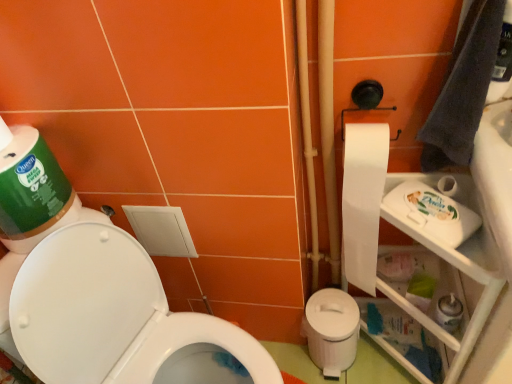
At what (x,y) coordinates should I click in order to perform the action: click on white glossy toilet at lower left. Please return your answer as a coordinate pair (x, y). This screenshot has width=512, height=384. Looking at the image, I should click on (117, 318).

Where is `white plastic potty at lower right`? This screenshot has width=512, height=384. white plastic potty at lower right is located at coordinates (331, 330).

This screenshot has width=512, height=384. I want to click on white paper at right, so click(362, 200).

What do you see at coordinates (463, 89) in the screenshot? I see `gray fabric hand towel at upper right` at bounding box center [463, 89].

This screenshot has width=512, height=384. I want to click on white glossy toilet at lower left, so click(117, 318).

Is point (208, 379) more distant than point (502, 127)?

That is True.

Can you tell me how much white glossy toilet at lower left and white glossy sink at upper right differ in facing direction?

white glossy toilet at lower left and white glossy sink at upper right are facing 88.3 degrees away from each other.

Is white glossy toilet at lower left directly adjacent to white glossy sink at upper right?

No, white glossy toilet at lower left is not next to white glossy sink at upper right.

Considering the sizes of objects white glossy toilet at lower left and white glossy sink at upper right in the image provided, who is shorter, white glossy toilet at lower left or white glossy sink at upper right?

Standing shorter between the two is white glossy sink at upper right.

Identify the location of shelf on the right of the white paper at right. The height and width of the screenshot is (384, 512). (462, 271).

Relative to white paper at right, is white plastic shelf at right in front or behind?

Clearly, white plastic shelf at right is in front of white paper at right.

From the image's perspective, between white plastic shelf at right and white paper at right, which one is located above?

white paper at right appears higher in the image.

You are a GUI agent. You are given a task and a screenshot of the screen. Output one action in this format:
    pyautogui.click(x=<x>, y=<y>)
    Task: Click on the toilet paper positioned vertically above the white plastic potty at lower right (from a real-world perspective)
    Image resolution: width=512 pixels, height=384 pixels.
    Given the screenshot: What is the action you would take?
    pyautogui.click(x=362, y=200)

From the image's perspective, is white plastic potty at lower right above white paper at right?

No, from the image's perspective, white plastic potty at lower right is not over white paper at right.

From a real-world perspective, is white plastic potty at lower right positioned above or below white paper at right?

In terms of real-world spatial position, white plastic potty at lower right is below white paper at right.

Is white plastic potty at lower right bigger than white paper at right?

Correct, white plastic potty at lower right is larger in size than white paper at right.

Are white paper at right and gray fabric hand towel at upper right far apart?

They are positioned close to each other.

Between point (346, 161) and point (483, 99), which one is positioned behind?

The point (346, 161) is more distant.

From the image's perspective, is white paper at right above or below gray fabric hand towel at upper right?

Clearly, from the image's perspective, white paper at right is below gray fabric hand towel at upper right.

Can you tell me how much white paper at right and gray fabric hand towel at upper right differ in facing direction?

white paper at right and gray fabric hand towel at upper right are facing 5.97e-05 degrees away from each other.

From a real-world perspective, between white plastic shelf at right and white plastic potty at lower right, who is vertically higher?

white plastic shelf at right is physically above.

This screenshot has width=512, height=384. Find the location of `shelf above the white plastic potty at lower right (from the image's perspective)`. shelf above the white plastic potty at lower right (from the image's perspective) is located at coordinates (462, 271).

Is white plastic potty at lower right inside white plastic shelf at right?

Yes, white plastic shelf at right contains white plastic potty at lower right.

Measure the distance from white plastic shelf at right to white plastic potty at lower right.

white plastic shelf at right is 10.98 inches away from white plastic potty at lower right.

Based on their positions, is white plastic shelf at right located to the left or right of white glossy toilet at lower left?

white plastic shelf at right is positioned on white glossy toilet at lower left's right side.

Would you consider white plastic shelf at right to be distant from white glossy toilet at lower left?

No, there isn't a large distance between white plastic shelf at right and white glossy toilet at lower left.

Can you confirm if white plastic shelf at right is taller than white glossy toilet at lower left?

Incorrect, the height of white plastic shelf at right is not larger of that of white glossy toilet at lower left.

Between white plastic shelf at right and white glossy toilet at lower left, which one has smaller width?

Thinner between the two is white plastic shelf at right.

Would you say white plastic potty at lower right is part of gray fabric hand towel at upper right's contents?

Definitely not — white plastic potty at lower right is not inside gray fabric hand towel at upper right.

Does gray fabric hand towel at upper right turn towards white plastic potty at lower right?

No, gray fabric hand towel at upper right is not facing towards white plastic potty at lower right.

From a real-world perspective, is gray fabric hand towel at upper right positioned over white plastic potty at lower right based on gravity?

Yes, from a real-world perspective, gray fabric hand towel at upper right is above white plastic potty at lower right.

From the image's perspective, between gray fabric hand towel at upper right and white plastic potty at lower right, who is located below?

white plastic potty at lower right.

The width and height of the screenshot is (512, 384). I want to click on toilet lying below the white glossy sink at upper right (from the image's perspective), so click(117, 318).

Locate an element on the screen. shelf lying on the right of white paper at right is located at coordinates (462, 271).

Estimate the real-world distances between objects in this image. Which object is closer to white glossy sink at upper right, white plastic potty at lower right or white paper at right?

white paper at right is closer to white glossy sink at upper right.

Based on their spatial positions, is white plastic shelf at right or gray fabric hand towel at upper right closer to white glossy sink at upper right?

gray fabric hand towel at upper right.

Estimate the real-world distances between objects in this image. Which object is closer to gray fabric hand towel at upper right, white paper at right or white glossy sink at upper right?

white glossy sink at upper right.

Which object lies nearer to the anchor point white plastic potty at lower right, white glossy toilet at lower left or gray fabric hand towel at upper right?

white glossy toilet at lower left is closer to white plastic potty at lower right.

Based on their spatial positions, is white plastic potty at lower right or white plastic shelf at right further from white glossy sink at upper right?

Based on the image, white plastic potty at lower right appears to be further to white glossy sink at upper right.

Based on their spatial positions, is white glossy toilet at lower left or white glossy sink at upper right closer to white paper at right?

white glossy sink at upper right is closer to white paper at right.

From the image, which object appears to be farther from white paper at right, white plastic shelf at right or white plastic potty at lower right?

white plastic potty at lower right is positioned further to the anchor white paper at right.

Estimate the real-world distances between objects in this image. Which object is closer to white plastic shelf at right, gray fabric hand towel at upper right or white glossy sink at upper right?

gray fabric hand towel at upper right lies closer to white plastic shelf at right than the other object.

I want to click on toilet paper between white glossy sink at upper right and white plastic potty at lower right from top to bottom, so click(362, 200).

Image resolution: width=512 pixels, height=384 pixels. In order to click on toilet paper between gray fabric hand towel at upper right and white plastic shelf at right in the vertical direction in this screenshot , I will do `click(362, 200)`.

This screenshot has width=512, height=384. In order to click on toilet paper between white glossy sink at upper right and white plastic shelf at right in the vertical direction in this screenshot , I will do point(362,200).

This screenshot has width=512, height=384. Identify the location of toilet paper between white glossy toilet at lower left and gray fabric hand towel at upper right from left to right. 362,200.